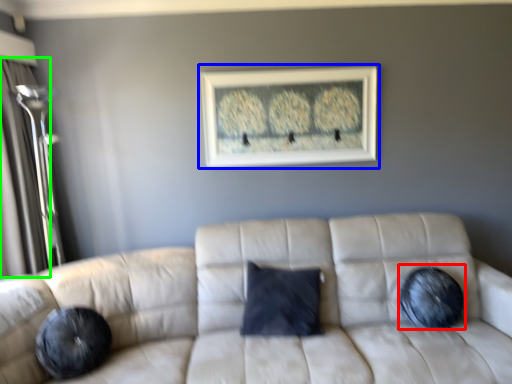
Question: Which is nearer to the pillow (highlighted by a red box)? picture frame (highlighted by a blue box) or glass door (highlighted by a green box).

Choices:
 (A) picture frame
 (B) glass door

Answer: (A)